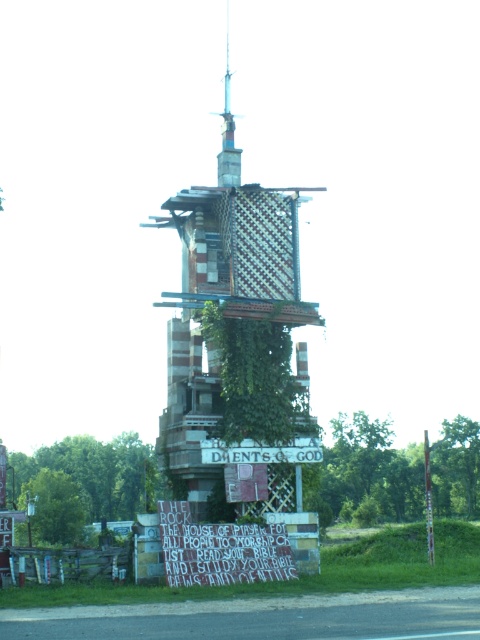
Is rusty metal tower at center further to camera compared to white wooden sign at center?

No, rusty metal tower at center is closer to the viewer.

The width and height of the screenshot is (480, 640). Find the location of `rusty metal tower at center`. rusty metal tower at center is located at coordinates (239, 342).

Does point (218, 321) come in front of point (425, 464)?

Yes, point (218, 321) is in front of point (425, 464).

Can you confirm if rusty metal tower at center is taller than green wood pole at right?

Correct, rusty metal tower at center is much taller as green wood pole at right.

Between point (300, 500) and point (432, 522), which one is positioned behind?

The point (432, 522) is behind.

Where is `rusty metal tower at center`? This screenshot has width=480, height=640. rusty metal tower at center is located at coordinates (239, 342).

Between green leafy ivy at center and green wood pole at right, which one has more height?

green wood pole at right

Where is `green leafy ivy at center`? green leafy ivy at center is located at coordinates (252, 376).

Does point (292, 401) come behind point (424, 460)?

No.

This screenshot has width=480, height=640. I want to click on green leafy ivy at center, so click(x=252, y=376).